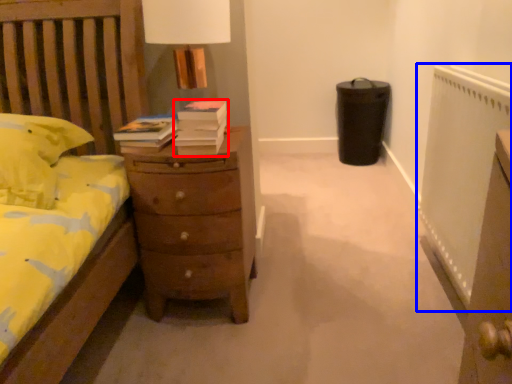
Question: Which of the following is the farthest to the observer, book (highlighted by a red box) or radiator (highlighted by a blue box)?

Choices:
 (A) book
 (B) radiator

Answer: (A)